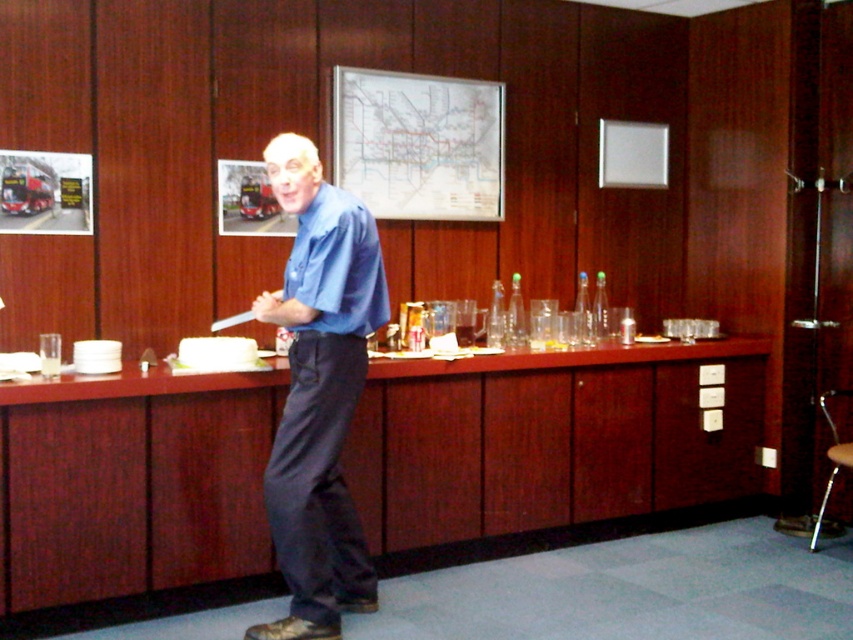
Question: Is blue smooth shirt at center in front of metallic silver stool at lower right?

Choices:
 (A) yes
 (B) no

Answer: (A)

Question: Is blue smooth shirt at center positioned before metallic silver stool at lower right?

Choices:
 (A) no
 (B) yes

Answer: (B)

Question: Which object appears closest to the camera in this image?

Choices:
 (A) metallic silver stool at lower right
 (B) blue smooth shirt at center

Answer: (B)

Question: Is blue smooth shirt at center below metallic silver stool at lower right?

Choices:
 (A) yes
 (B) no

Answer: (B)